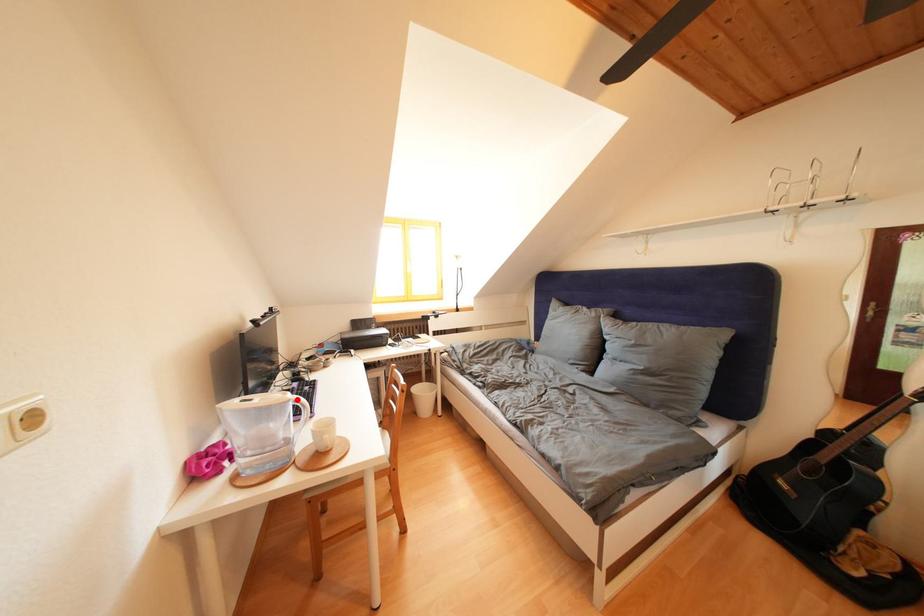
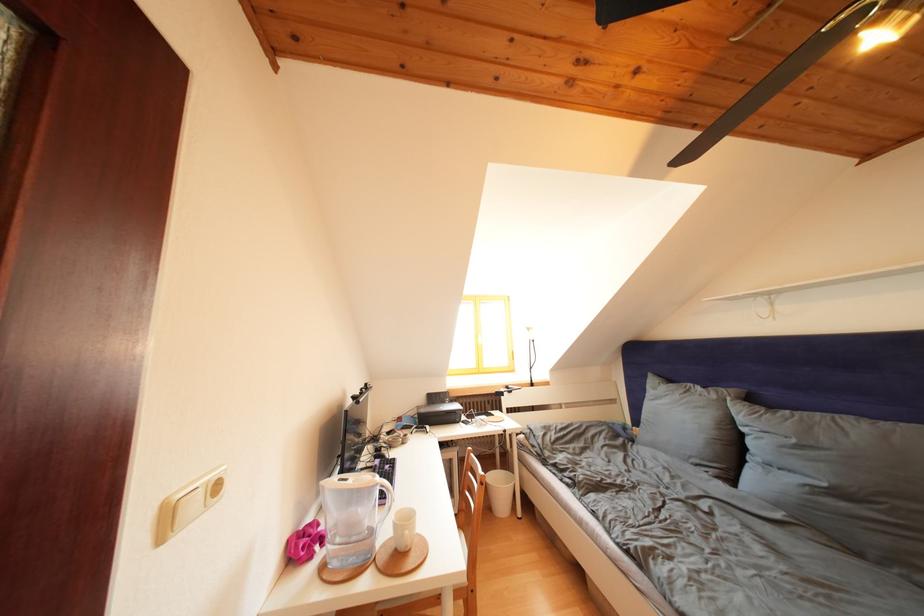
Locate, in the second image, the point that corresponds to the highlighted location in the first image.

(385, 482)